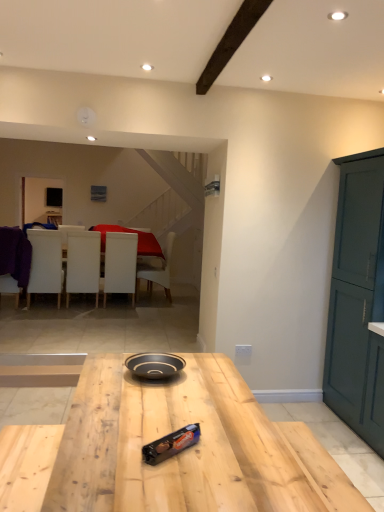
Image resolution: width=384 pixels, height=512 pixels. I want to click on vacant area located to the right-hand side of shiny chocolate bar at center, so click(229, 455).